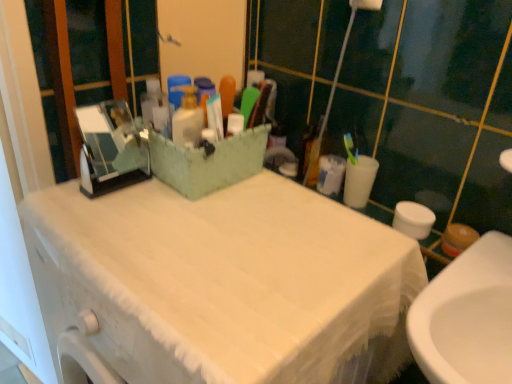
You are a GUI agent. You are given a task and a screenshot of the screen. Output one action in this format:
    pyautogui.click(x=<x>, y=<y>)
    Task: Click on the white fabric-covered cabinet at center
    The height and width of the screenshot is (384, 512).
    Given the screenshot: What is the action you would take?
    pyautogui.click(x=217, y=283)

What do you see at coordinates (217, 283) in the screenshot?
I see `white fabric-covered cabinet at center` at bounding box center [217, 283].

I want to click on white fabric-covered cabinet at center, so click(217, 283).